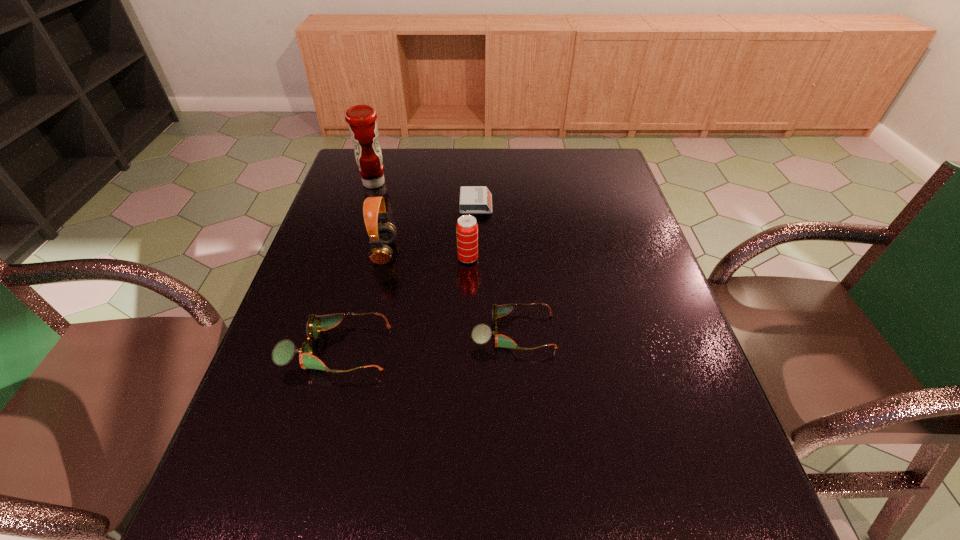
This screenshot has height=540, width=960. What are the coordinates of `vacant area at the far edge` in the screenshot? It's located at (499, 176).

The width and height of the screenshot is (960, 540). In the image, there is a desktop. Find the location of `vacant space at the near edge`. vacant space at the near edge is located at coordinates (407, 454).

Locate an element on the screen. This screenshot has height=540, width=960. vacant area at the left edge is located at coordinates (341, 207).

Where is `free region at the right edge of the desktop`? This screenshot has width=960, height=540. free region at the right edge of the desktop is located at coordinates (625, 200).

Where is `free space at the far left corner of the desktop`? free space at the far left corner of the desktop is located at coordinates (388, 157).

Locate an element on the screen. The image size is (960, 540). free region at the far right corner of the desktop is located at coordinates (591, 173).

At what (x,y) coordinates should I click in order to perform the action: click on vacant space that's between the soda can and the second tallest object. Please return your answer as a coordinate pair (x, y). Looking at the image, I should click on click(x=426, y=255).

Locate an element on the screen. blank region between the condiment and the fifth nearest object is located at coordinates (425, 194).

Locate an element on the screen. Image resolution: width=960 pixels, height=540 pixels. empty location between the fifth tallest object and the alarm clock is located at coordinates (494, 268).

Where is `vacant area that lies between the fifth shortest object and the alarm clock`? The height and width of the screenshot is (540, 960). vacant area that lies between the fifth shortest object and the alarm clock is located at coordinates (430, 228).